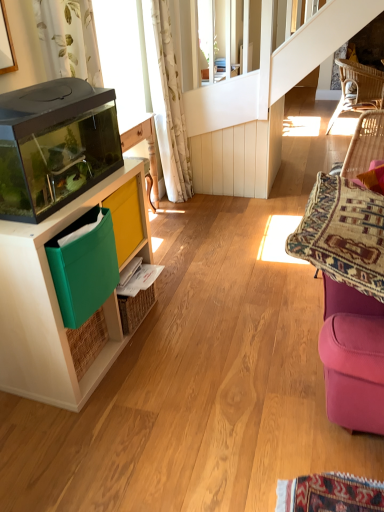
Find the location of `free space to the right of matte wood cabinet at left`. free space to the right of matte wood cabinet at left is located at coordinates (204, 337).